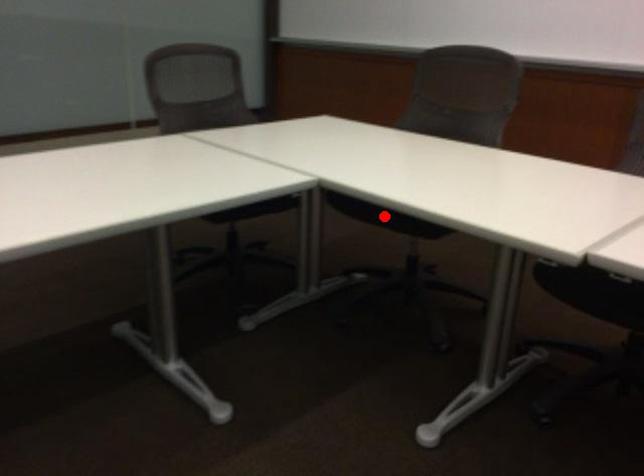
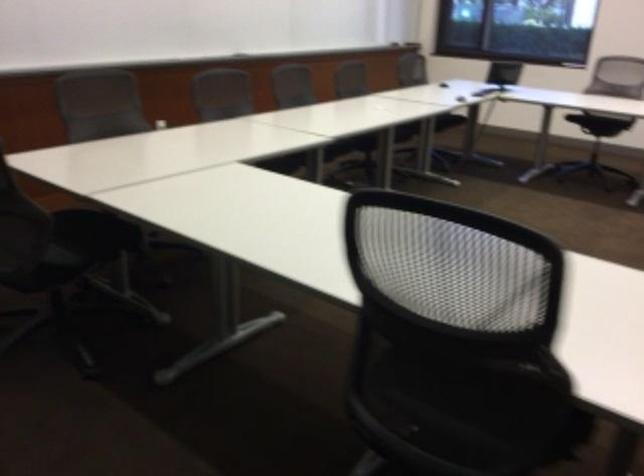
Question: I am providing you with two images of the same scene from different viewpoints. A red point is marked on the first image. Can you still see the location of the red point in image 2?

Choices:
 (A) Yes
 (B) No

Answer: (B)